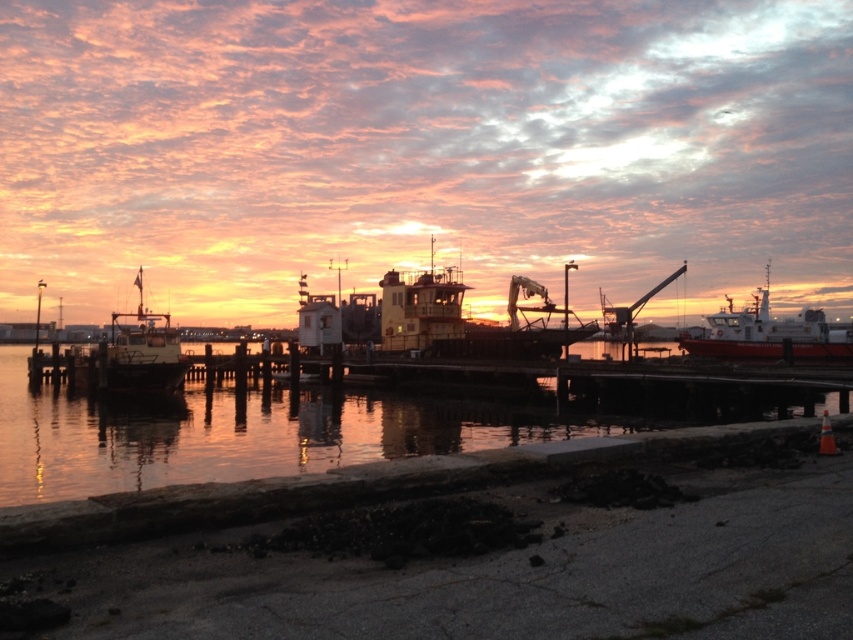
Can you confirm if glossy water at center is wider than yellow matte boat at center?

Yes.

The width and height of the screenshot is (853, 640). Identify the location of glossy water at center. (238, 435).

In the scene shown: Does yellow matte boat at center have a larger size compared to matte white boat at left?

No, yellow matte boat at center is not bigger than matte white boat at left.

Does yellow matte boat at center come in front of matte white boat at left?

That is False.

At what (x,y) coordinates should I click in order to perform the action: click on yellow matte boat at center. Please return your answer as a coordinate pair (x, y). Image resolution: width=853 pixels, height=640 pixels. Looking at the image, I should click on (450, 317).

Who is lower down, yellow matte boat at center or red matte boat at right?

red matte boat at right is lower down.

Is point (422, 346) closer to viewer compared to point (792, 328)?

Yes, point (422, 346) is in front of point (792, 328).

Locate an element on the screen. The width and height of the screenshot is (853, 640). yellow matte boat at center is located at coordinates (450, 317).